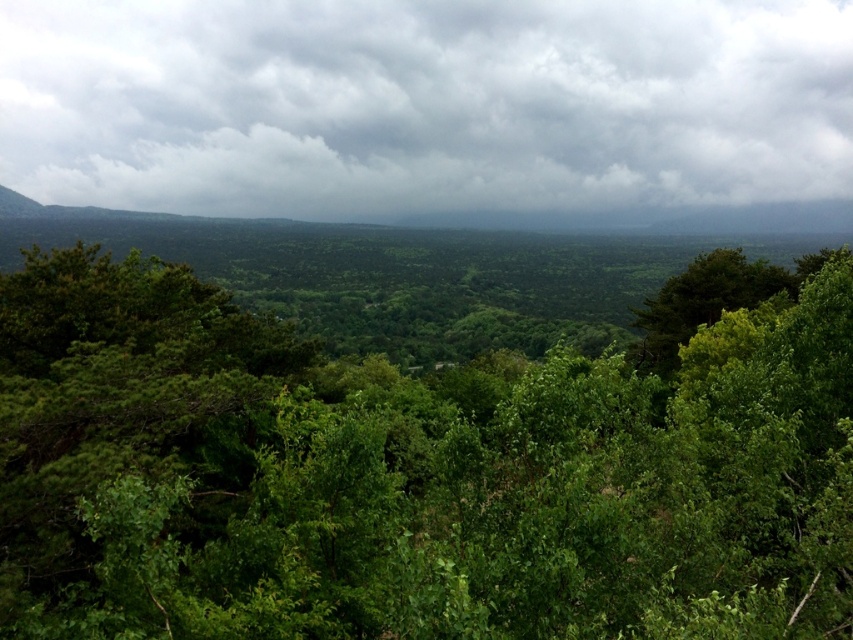
What do you see at coordinates (410, 474) in the screenshot? The image size is (853, 640). I see `green leafy tree at center` at bounding box center [410, 474].

Is green leafy tree at center further to the viewer compared to green leafy tree at right?

No.

Does point (641, 460) come in front of point (757, 304)?

Yes, point (641, 460) is in front of point (757, 304).

Where is `green leafy tree at center`? green leafy tree at center is located at coordinates (410, 474).

Which is above, green leafy tree at center or gray fluffy cloud at upper center?

gray fluffy cloud at upper center is above.

Is point (843, 444) farther from viewer compared to point (221, 148)?

No, (843, 444) is in front of (221, 148).

The width and height of the screenshot is (853, 640). In order to click on green leafy tree at center in this screenshot , I will do `click(410, 474)`.

Between gray fluffy cloud at upper center and green leafy tree at right, which one appears on the left side from the viewer's perspective?

From the viewer's perspective, gray fluffy cloud at upper center appears more on the left side.

Does gray fluffy cloud at upper center have a larger size compared to green leafy tree at right?

Correct, gray fluffy cloud at upper center is larger in size than green leafy tree at right.

Does point (305, 49) come in front of point (776, 278)?

No, it is not.

In order to click on gray fluffy cloud at upper center in this screenshot , I will do `click(422, 104)`.